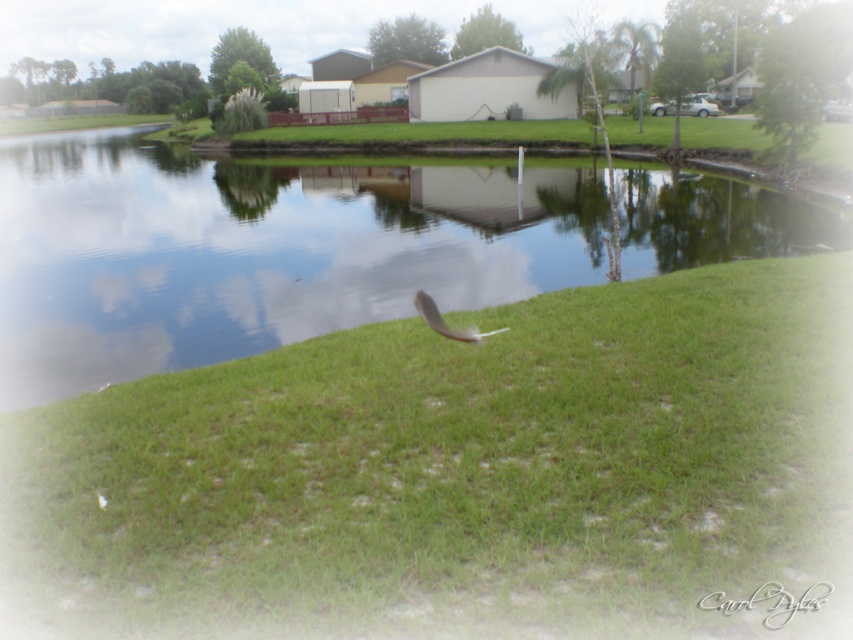
Looking at this image, you are standing at the origin of the coordinate system in the scene. You see two points, point (286, 461) and point (482, 337). Which point is closer to you?

Point (286, 461) is in front of point (482, 337), so it is closer to you.

You are a drone operator who needs to fly a drone from the transparent glass water at center to the white feather at center. What is the minimum distance you need to fly the drone?

The minimum distance you need to fly the drone is 22.95 meters between transparent glass water at center and white feather at center.